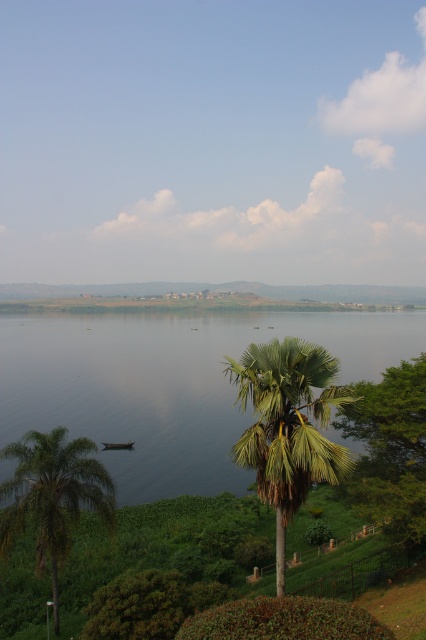
Is point (258, 396) farther from camera compared to point (62, 502)?

No, (258, 396) is in front of (62, 502).

Does green leafy palm tree at center have a lesser width compared to green leafy palm tree at lower left?

Correct, green leafy palm tree at center's width is less than green leafy palm tree at lower left's.

Does point (296, 385) lie in front of point (72, 492)?

Yes, point (296, 385) is in front of point (72, 492).

The image size is (426, 640). I want to click on green leafy palm tree at center, so (x=287, y=426).

Who is taller, green leafy tree at lower right or dark green wooden boat at lower left?

dark green wooden boat at lower left is taller.

At what (x,y) coordinates should I click in order to perform the action: click on green leafy tree at lower right. Please return your answer as a coordinate pair (x, y). The height and width of the screenshot is (640, 426). Looking at the image, I should click on (391, 449).

Find the location of `green leafy tree at lower right`. green leafy tree at lower right is located at coordinates (391, 449).

Does green leafy palm tree at center appear on the right side of green leafy tree at lower right?

Incorrect, green leafy palm tree at center is not on the right side of green leafy tree at lower right.

Does point (259, 429) come behind point (359, 477)?

No, it is in front of (359, 477).

Who is more forward, (317, 460) or (357, 381)?

Point (317, 460) is more forward.

The height and width of the screenshot is (640, 426). Identify the location of green leafy palm tree at center. (287, 426).